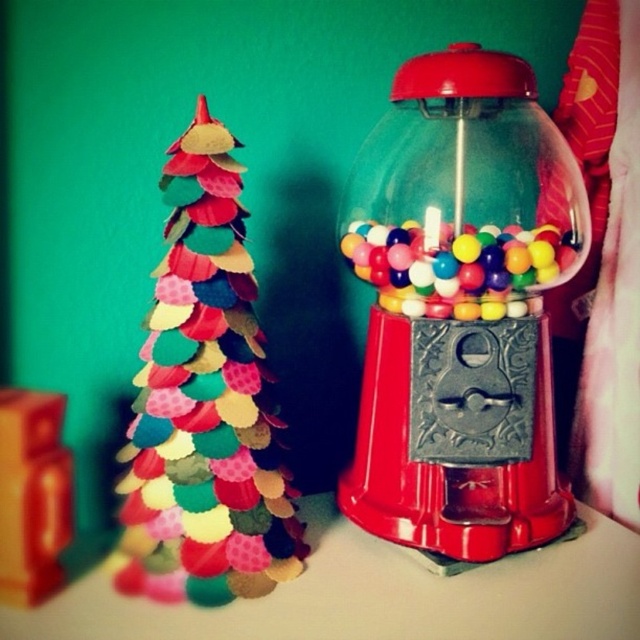
You are a toy store manager who wants to place a new shelf between the multicolored felt christmas tree at left and the shiny plastic gumballs at center. The shelf must be exactly halfway between them. Given that the distance between the two objects is 1.2 meters, how wide should the shelf be to fit perfectly between them?

The shelf should be 0.6 meters wide to fit perfectly between the multicolored felt christmas tree at left and the shiny plastic gumballs at center since the halfway point of 1.2 meters is 0.6 meters.

From the picture: You are a child who wants to place a shiny plastic gumballs at center on top of the multicolored felt christmas tree at left. Can you do this without the gumballs falling off?

The multicolored felt christmas tree at left is taller than the shiny plastic gumballs at center, so placing the gumballs on top would require them to be positioned higher than their current height. However, since the tree is taller, it might provide enough height to place the gumballs securely without them falling off, as long as they are balanced properly.

You are a toy designer observing the scene. You need to place a new toy between the multicolored felt christmas tree at left and the shiny plastic gumballs at center. Where should you position it so it doesn not block the view of either object?

The multicolored felt christmas tree at left is located below the shiny plastic gumballs at center. To avoid blocking the view of either object, position the new toy between them horizontally at the same vertical level as the christmas tree but slightly elevated so it can be seen without obscuring either object.